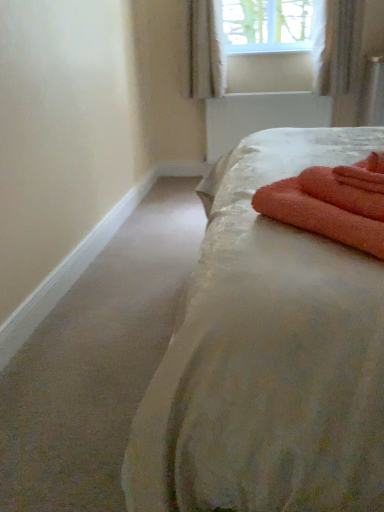
Question: Is white textured curtain at upper right, which appears as the second curtain when viewed from the left, in front of or behind orange terry cloth bath towel at right in the image?

Choices:
 (A) front
 (B) behind

Answer: (B)

Question: From their relative heights in the image, would you say white textured curtain at upper right, which is the 1th curtain in right-to-left order, is taller or shorter than orange terry cloth bath towel at right?

Choices:
 (A) tall
 (B) short

Answer: (A)

Question: Based on their relative distances, which object is farther from the orange terry cloth bath towel at right?

Choices:
 (A) white sheer curtain at upper center, acting as the 2th curtain starting from the right
 (B) silky white bed at center
 (C) white textured curtain at upper right, which is the 1th curtain in right-to-left order

Answer: (A)

Question: Estimate the real-world distances between objects in this image. Which object is farther from the orange terry cloth bath towel at right?

Choices:
 (A) white sheer curtain at upper center, the first curtain positioned from the left
 (B) silky white bed at center
 (C) white textured curtain at upper right, which appears as the second curtain when viewed from the left

Answer: (A)